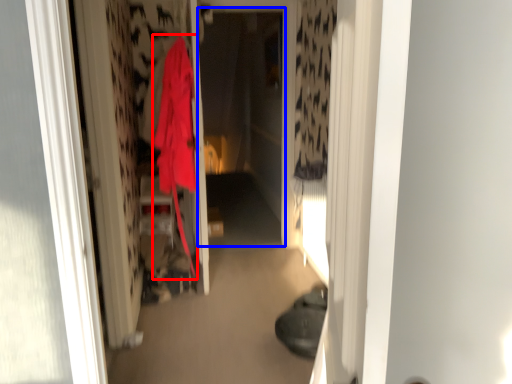
Question: Which object is closer to the camera taking this photo, cloak (highlighted by a red box) or screen door (highlighted by a blue box)?

Choices:
 (A) cloak
 (B) screen door

Answer: (A)